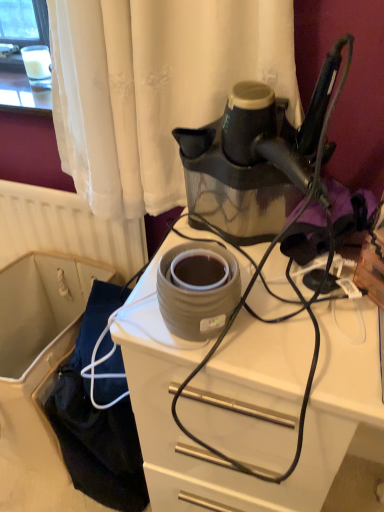
Where is `vacant area that lies between black rubber cord at center and matte gray ceramic pot at center`? The width and height of the screenshot is (384, 512). vacant area that lies between black rubber cord at center and matte gray ceramic pot at center is located at coordinates (239, 320).